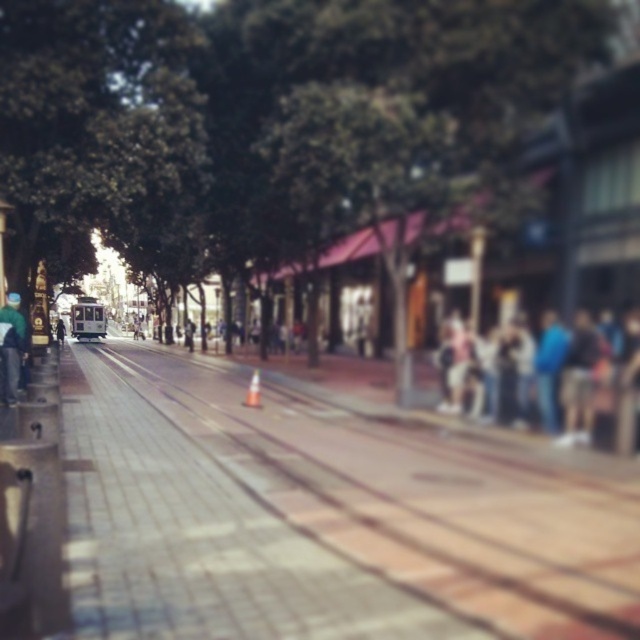
Which is more to the right, brick paved train track at left or blue denim jeans at center right?

blue denim jeans at center right is more to the right.

Which is above, brick paved train track at left or blue denim jeans at center right?

blue denim jeans at center right is above.

Find the location of `brick paved train track at left`. brick paved train track at left is located at coordinates (416, 496).

Is point (518, 417) more distant than point (61, 328)?

No.

Between blue denim jeans at center right and dark blue jacket at center, which one appears on the left side from the viewer's perspective?

Positioned to the left is dark blue jacket at center.

Is point (627, 445) closer to camera compared to point (60, 332)?

Yes, it is in front of point (60, 332).

You are a GUI agent. You are given a task and a screenshot of the screen. Output one action in this format:
    pyautogui.click(x=<x>, y=<y>)
    Task: Click on the blue denim jeans at center right
    The width and height of the screenshot is (640, 640).
    Given the screenshot: What is the action you would take?
    pyautogui.click(x=552, y=380)

Does point (356, 540) come closer to viewer compared to point (61, 342)?

That is True.

Can you confirm if brick paved train track at left is bigger than dark blue jacket at center?

No, brick paved train track at left is not bigger than dark blue jacket at center.

Does point (570, 541) lie behind point (60, 332)?

No, it is in front of (60, 332).

This screenshot has height=640, width=640. Identify the location of brick paved train track at left. (416, 496).